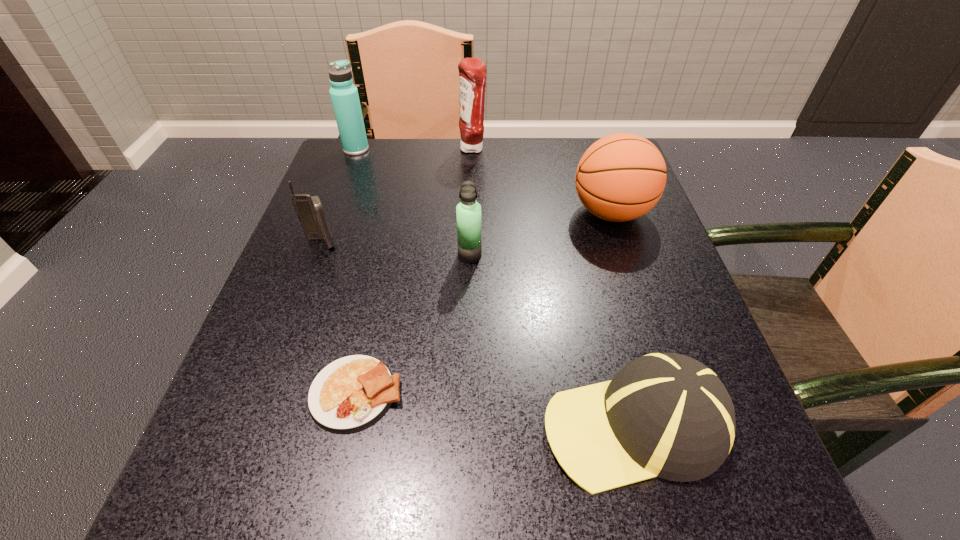
This screenshot has height=540, width=960. I want to click on condiment, so click(472, 71).

Image resolution: width=960 pixels, height=540 pixels. In order to click on the taller thermos bottle in this screenshot , I will do `click(344, 95)`.

Where is `the farther thermos bottle`? The height and width of the screenshot is (540, 960). the farther thermos bottle is located at coordinates (344, 95).

Where is `basketball`? Image resolution: width=960 pixels, height=540 pixels. basketball is located at coordinates (620, 177).

Find the location of `the nearer thermos bottle`. the nearer thermos bottle is located at coordinates (468, 211).

Image resolution: width=960 pixels, height=540 pixels. Find the location of `the shorter thermos bottle`. the shorter thermos bottle is located at coordinates (468, 211).

Locate an element on the screen. This screenshot has height=540, width=960. the third shortest object is located at coordinates (309, 209).

The height and width of the screenshot is (540, 960). I want to click on the second shortest object, so click(x=667, y=415).

Image resolution: width=960 pixels, height=540 pixels. I want to click on the shortest object, so click(x=351, y=393).

Identify the location of omelet. (351, 393).